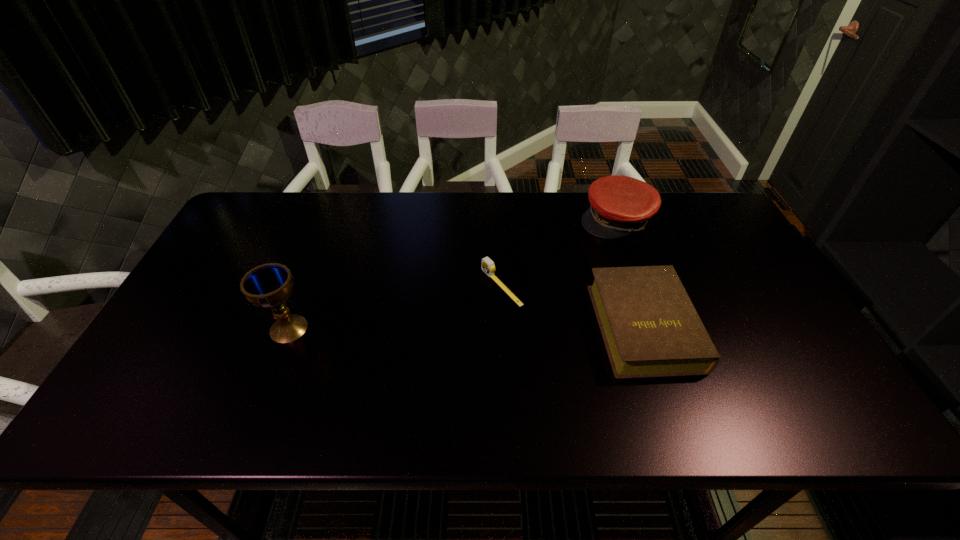
You are a GUI agent. You are given a task and a screenshot of the screen. Output one action in this format:
    pyautogui.click(x=<x>, y=<y>)
    Task: Click on the chalice
    The width and height of the screenshot is (960, 540).
    Given the screenshot: What is the action you would take?
    pyautogui.click(x=268, y=286)

You are a GUI agent. You are given a task and a screenshot of the screen. Output one action in this format:
    pyautogui.click(x=<x>, y=<y>)
    Task: Click on the leftmost object
    The height and width of the screenshot is (540, 960).
    Given the screenshot: What is the action you would take?
    pyautogui.click(x=268, y=286)

Locate an element on the screen. The height and width of the screenshot is (540, 960). Bible is located at coordinates (650, 328).

This screenshot has width=960, height=540. I want to click on the second object from left to right, so click(488, 267).

Identify the location of the shortest object. The height and width of the screenshot is (540, 960). [488, 267].

This screenshot has width=960, height=540. In order to click on cap in this screenshot , I will do `click(620, 205)`.

Find the location of a particular element. the second tallest object is located at coordinates [x=620, y=205].

The height and width of the screenshot is (540, 960). Identify the location of vacant area situated on the left of the chalice. (219, 328).

Identify the location of free space located on the back of the second shortest object. (623, 266).

The image size is (960, 540). Identify the location of vacant region located 0.370m at the front of the tape measure with the tape extended. (356, 363).